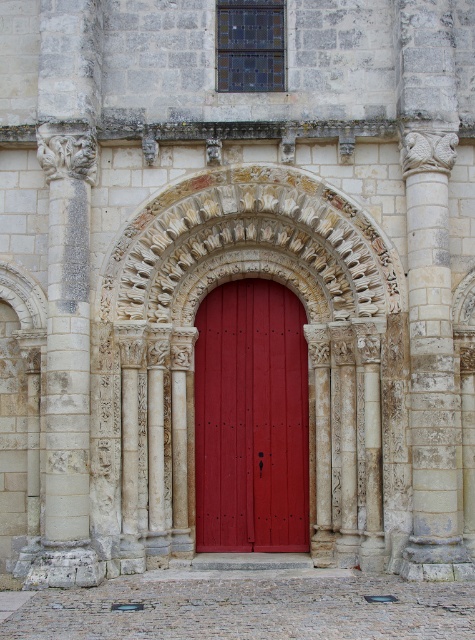
You are an architect examining the historic building. You need to determine the exact central point of the carved stone archway at center for structural analysis. What are the coordinates of its center?

The coordinates of the carved stone archway at center are at point [249,369].

You are a visitor standing in front of the historic building and want to enter through the door. Which side of the carved stone archway at center is the matte wood door at center located?

The matte wood door at center is located on the left side of the carved stone archway at center.

You are an architect visiting the historic building. You notice the carved stone archway at center and the matte wood door at center. Which one appears larger in size?

The carved stone archway at center is bigger than the matte wood door at center, so the carved stone archway at center appears larger in size.